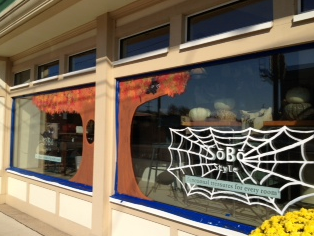
Identify the location of large plate glass window. (195, 105), (61, 127).